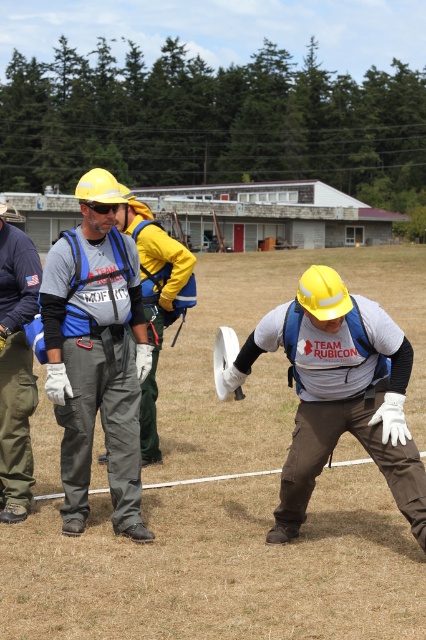
Which is above, matte gray jumpsuit at center or white fabric glove at lower center?

matte gray jumpsuit at center

Is matte gray jumpsuit at center to the right of white fabric glove at lower center from the viewer's perspective?

No, matte gray jumpsuit at center is not to the right of white fabric glove at lower center.

The width and height of the screenshot is (426, 640). What do you see at coordinates (95, 355) in the screenshot? I see `matte gray jumpsuit at center` at bounding box center [95, 355].

Image resolution: width=426 pixels, height=640 pixels. I want to click on matte gray jumpsuit at center, so click(x=95, y=355).

Does matte gray shirt at center have a greater width compared to white fabric glove at lower center?

Correct, the width of matte gray shirt at center exceeds that of white fabric glove at lower center.

Is point (351, 397) closer to camera compared to point (221, 381)?

Yes, it is in front of point (221, 381).

Where is `matte gray shirt at center`? The image size is (426, 640). matte gray shirt at center is located at coordinates (339, 392).

Where is `matte gray shirt at center`? matte gray shirt at center is located at coordinates (339, 392).

Between point (158, 337) and point (215, 332), which one is positioned in front?

Point (158, 337)

Consider the image. Can you confirm if matte blue vest at center is positioned above white fabric glove at lower center?

Yes, matte blue vest at center is above white fabric glove at lower center.

Is point (132, 220) behind point (227, 330)?

Yes, point (132, 220) is farther from viewer.

Find the location of a particular element. The height and width of the screenshot is (640, 426). matte blue vest at center is located at coordinates (155, 300).